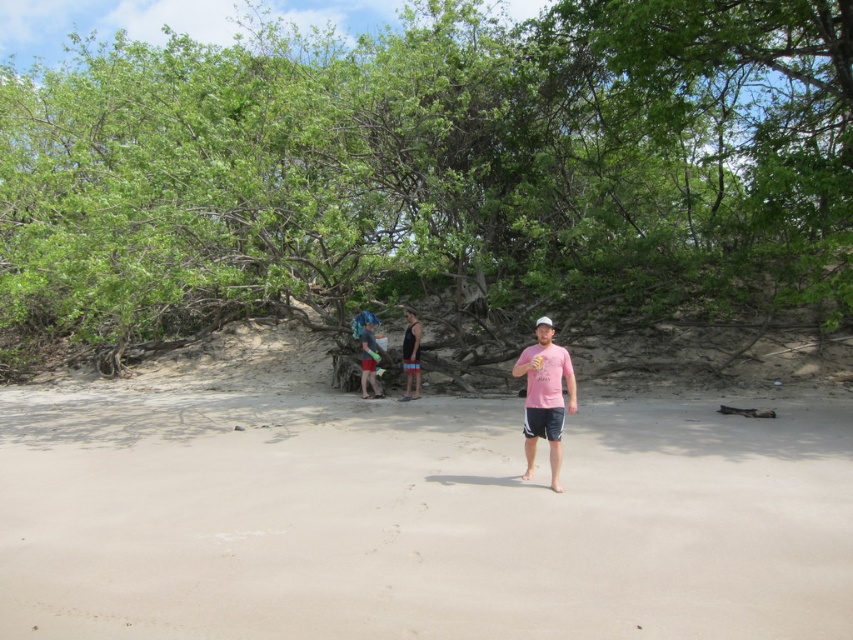
Between green leafy tree at center and black tank top at center, which one appears on the left side from the viewer's perspective?

Positioned to the left is green leafy tree at center.

Based on the photo, does green leafy tree at center appear on the right side of black tank top at center?

No, green leafy tree at center is not to the right of black tank top at center.

Who is more distant from viewer, (671, 289) or (418, 376)?

The point (671, 289) is behind.

Image resolution: width=853 pixels, height=640 pixels. Find the location of `green leafy tree at center`. green leafy tree at center is located at coordinates (438, 170).

Does point (177, 45) come behind point (718, 454)?

Yes, point (177, 45) is behind point (718, 454).

Which is below, green leafy tree at center or light beige sand at center?

light beige sand at center is lower down.

This screenshot has height=640, width=853. What do you see at coordinates (438, 170) in the screenshot? I see `green leafy tree at center` at bounding box center [438, 170].

You are a GUI agent. You are given a task and a screenshot of the screen. Output one action in this format:
    pyautogui.click(x=<x>, y=<y>)
    Task: Click on the green leafy tree at center
    Image resolution: width=853 pixels, height=640 pixels.
    Given the screenshot: What is the action you would take?
    pyautogui.click(x=438, y=170)

Is the position of light beige sand at center less distant than that of blue fabric bag at center?

Yes, light beige sand at center is in front of blue fabric bag at center.

Between point (480, 460) and point (364, 387), which one is positioned behind?

The point (364, 387) is behind.

Is point (474, 582) positioned before point (368, 321)?

Yes, point (474, 582) is in front of point (368, 321).

At what (x,y) coordinates should I click in order to perform the action: click on light beige sand at center. Please return your answer as a coordinate pair (x, y). Looking at the image, I should click on (416, 518).